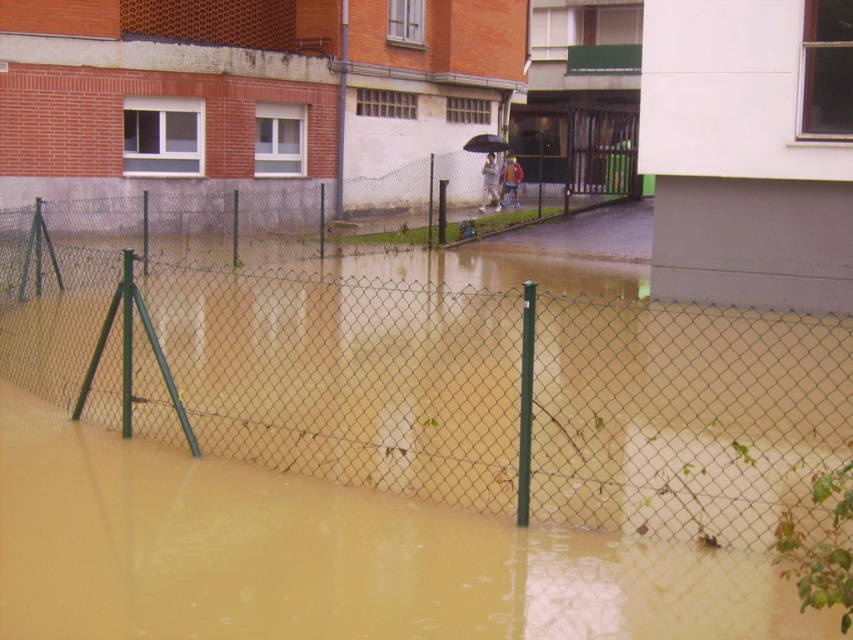
Question: Can you confirm if brown muddy water at lower center is bigger than green chain-link fence at center?

Choices:
 (A) yes
 (B) no

Answer: (B)

Question: Does brown muddy water at lower center have a greater width compared to green chain-link fence at center?

Choices:
 (A) no
 (B) yes

Answer: (A)

Question: Which point is closer to the camera taking this photo?

Choices:
 (A) (506, 148)
 (B) (252, 488)

Answer: (B)

Question: Estimate the real-world distances between objects in this image. Which object is closer to the brown muddy water at lower center?

Choices:
 (A) black matte umbrella at center
 (B) green chain-link fence at center

Answer: (B)

Question: Is brown muddy water at lower center thinner than green chain-link fence at center?

Choices:
 (A) no
 (B) yes

Answer: (B)

Question: Which point is farther to the camera?

Choices:
 (A) (155, 236)
 (B) (463, 148)
 (C) (212, 620)

Answer: (B)